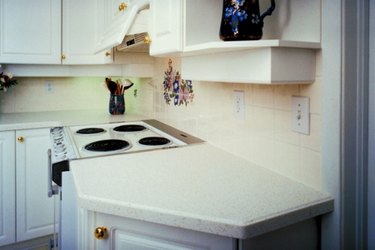
Find the location of a particular element. This screenshot has width=375, height=250. bottom cupboard is located at coordinates (118, 233), (26, 157), (8, 162).